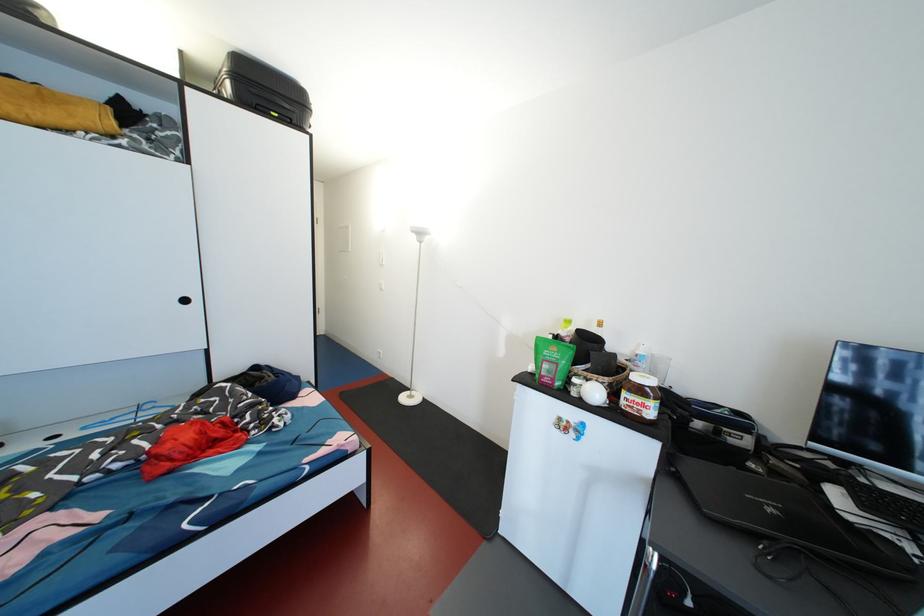
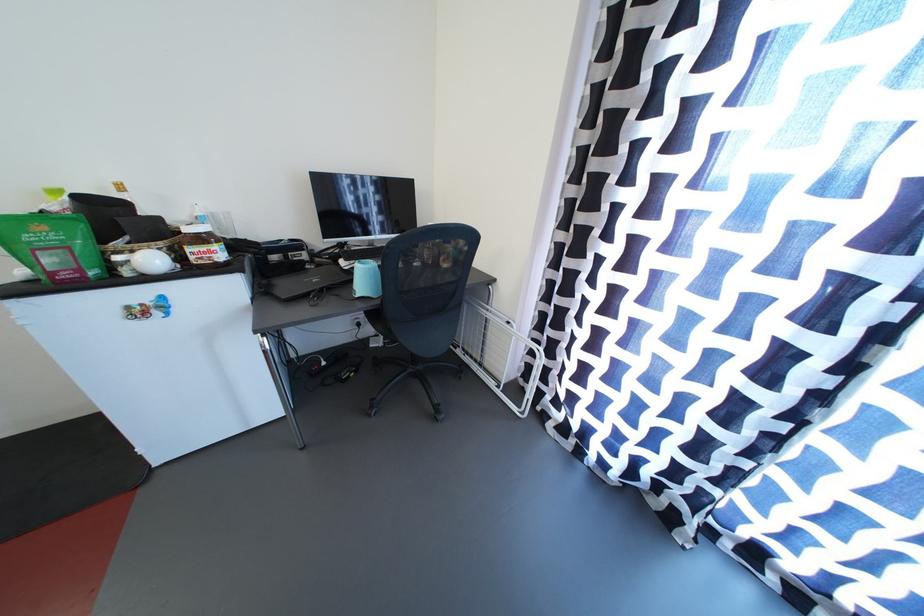
Where in the second image is the point corresponding to the point at 581,369 from the first image?

(110, 246)